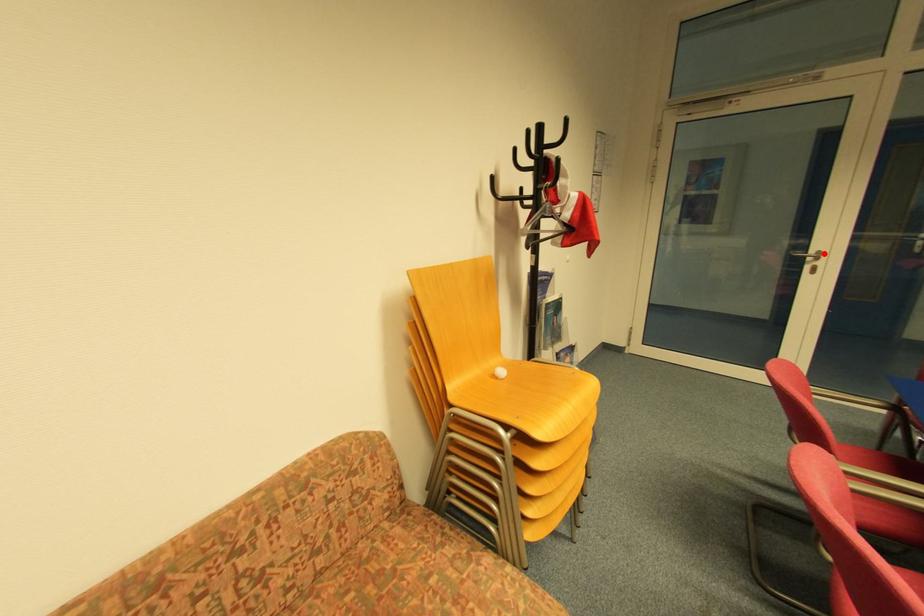
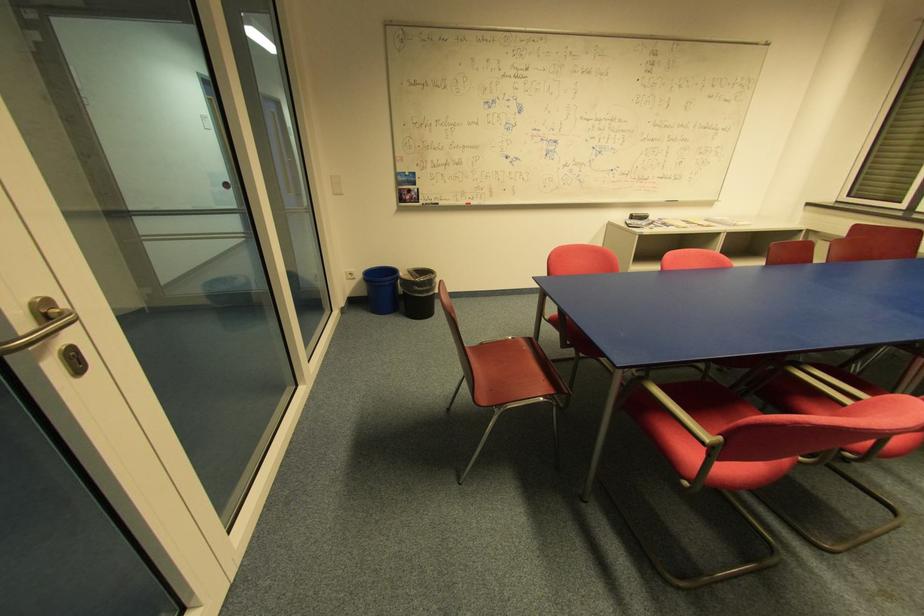
Question: I am providing you with two images of the same scene from different viewpoints. Image1 has a red point marked. In image2, the corresponding 3D location appears at what relative position? Reply with the corresponding letter.

Choices:
 (A) Closer
 (B) Farther

Answer: (B)